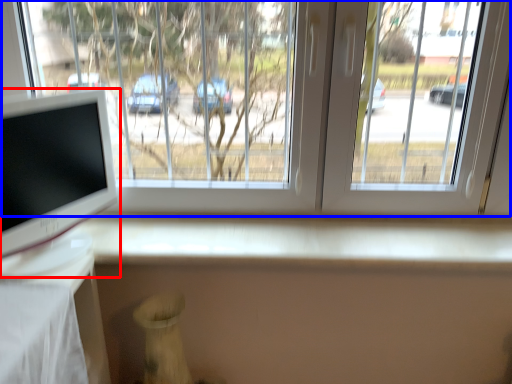
Question: Which object is further to the camera taking this photo, computer monitor (highlighted by a red box) or window (highlighted by a blue box)?

Choices:
 (A) computer monitor
 (B) window

Answer: (B)